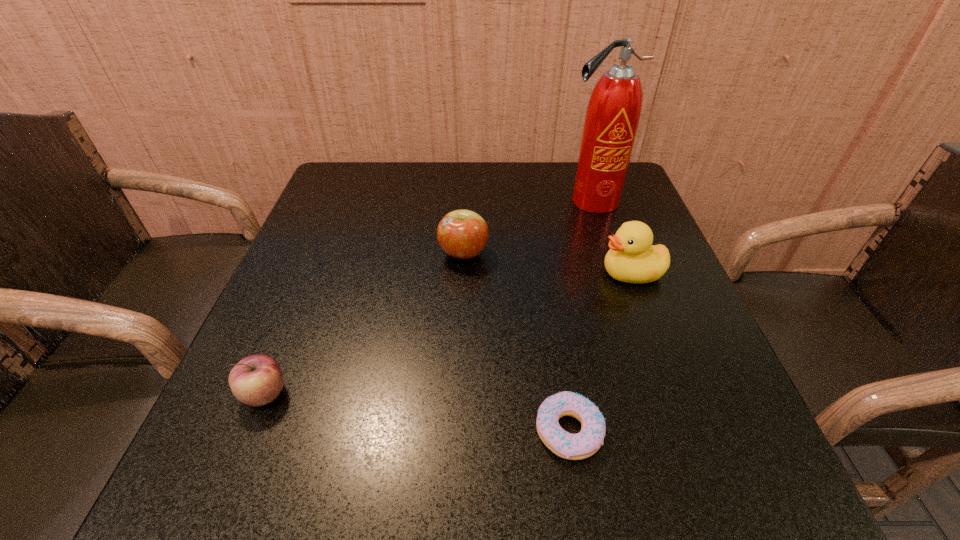
Locate an element on the screen. duck positioned at the right edge is located at coordinates (632, 258).

What are the coordinates of `object at the far right corner` in the screenshot? It's located at (614, 109).

The width and height of the screenshot is (960, 540). In the image, there is a desktop. In order to click on blank space at the far edge in this screenshot , I will do `click(457, 166)`.

Where is `free region at the near edge`? The image size is (960, 540). free region at the near edge is located at coordinates (349, 463).

The width and height of the screenshot is (960, 540). What are the coordinates of `blank area at the left edge` in the screenshot? It's located at (276, 419).

In order to click on blank area at the right edge in this screenshot , I will do pos(607,249).

This screenshot has height=540, width=960. In the image, there is a desktop. Find the location of `vacant space at the far left corner`. vacant space at the far left corner is located at coordinates (338, 182).

Locate an element on the screen. free space at the near right corner of the desktop is located at coordinates (719, 454).

You are a GUI agent. You are given a task and a screenshot of the screen. Output one action in this format:
    pyautogui.click(x=<x>, y=<y>)
    Task: Click on the free area in between the third object from right to left and the leftmost object
    Image resolution: width=960 pixels, height=540 pixels.
    Given the screenshot: What is the action you would take?
    pyautogui.click(x=418, y=413)

You are a GUI agent. You are given a task and a screenshot of the screen. Output one action in this format:
    pyautogui.click(x=<x>, y=<y>)
    Task: Click on the vacant point located between the doughnut and the right apple
    This screenshot has height=540, width=960.
    Given the screenshot: What is the action you would take?
    pyautogui.click(x=516, y=342)